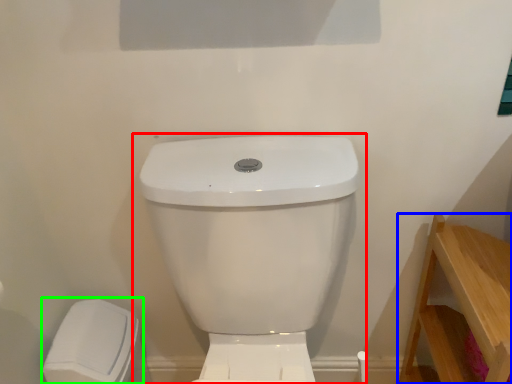
Question: Which object is positioned farthest from toilet (highlighted by a red box)? Select from furniture (highlighted by a blue box) and porcelain (highlighted by a green box).

Choices:
 (A) furniture
 (B) porcelain

Answer: (B)